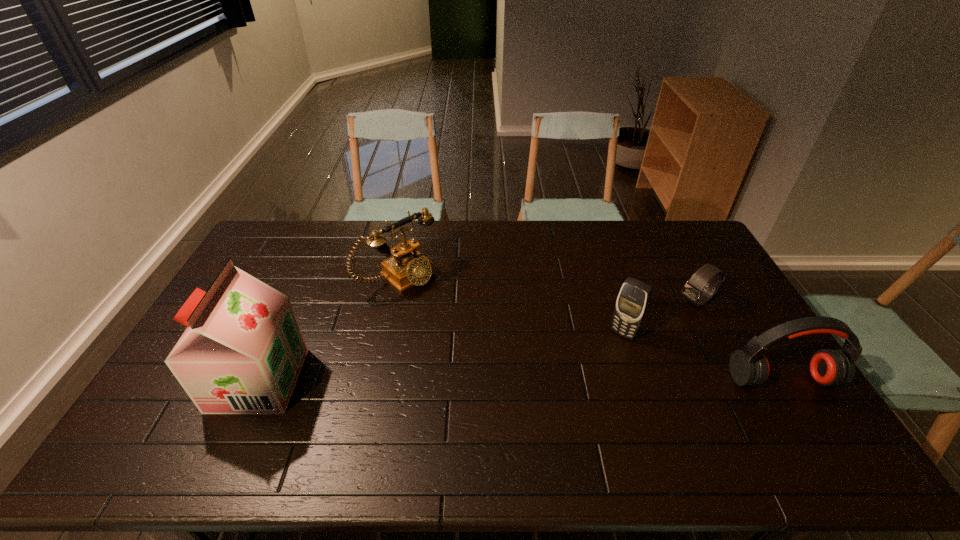
Find the location of a particular element. The width and height of the screenshot is (960, 540). vacant point located on the ear cups of the earphone is located at coordinates (801, 410).

At what (x,y) coordinates should I click in order to perform the action: click on vacant region located 0.140m on the front face of the cellular telephone. Please return your answer as a coordinate pair (x, y). The height and width of the screenshot is (540, 960). Looking at the image, I should click on (594, 370).

The image size is (960, 540). In order to click on vacant space located on the front face of the cellular telephone in this screenshot , I will do `click(560, 414)`.

Where is `free spot located on the front face of the cellular telephone`? The width and height of the screenshot is (960, 540). free spot located on the front face of the cellular telephone is located at coordinates (576, 394).

The width and height of the screenshot is (960, 540). I want to click on free space located on the dial number of the fourth object from right to left, so click(458, 325).

Locate an element on the screen. The width and height of the screenshot is (960, 540). free location located 0.130m on the dial number of the fourth object from right to left is located at coordinates (445, 314).

Image resolution: width=960 pixels, height=540 pixels. I want to click on vacant space located 0.170m on the dial number of the fourth object from right to left, so click(453, 321).

This screenshot has height=540, width=960. I want to click on vacant space located 0.240m on the face of the watch, so click(x=632, y=341).

At what (x,y) coordinates should I click in order to perform the action: click on free space located 0.210m on the face of the watch. Please return your answer as a coordinate pair (x, y). Image resolution: width=960 pixels, height=540 pixels. Looking at the image, I should click on (638, 336).

Image resolution: width=960 pixels, height=540 pixels. What are the coordinates of `vacant space located on the face of the watch` in the screenshot? It's located at (606, 357).